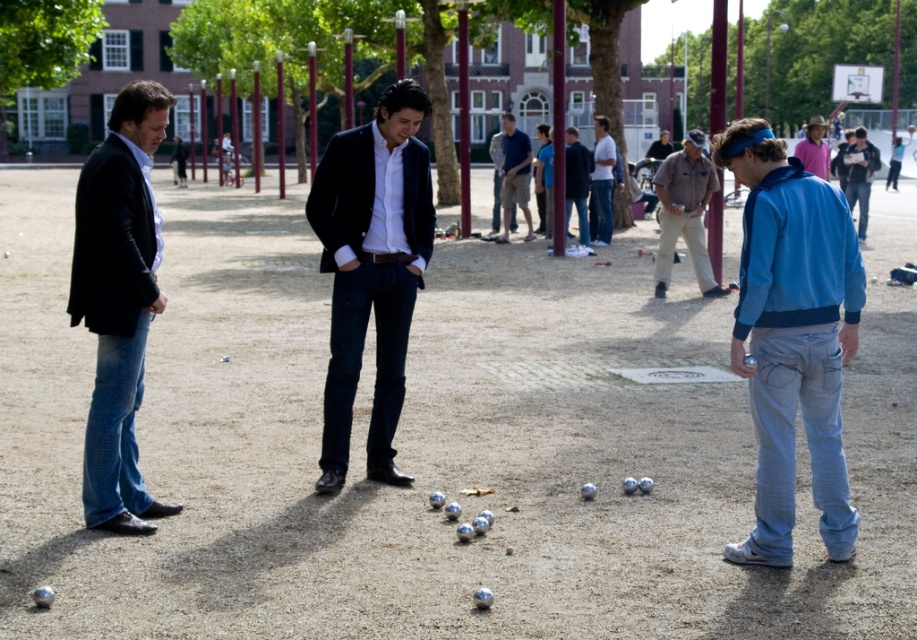
Does blue fleece jacket at right have a smaller size compared to dark blue jeans at center?

No.

Which is above, blue fleece jacket at right or dark blue jeans at center?

dark blue jeans at center is above.

Who is more forward, (810, 312) or (576, 182)?

Point (810, 312)

At what (x,y) coordinates should I click in order to perform the action: click on blue fleece jacket at right. Please return your answer as a coordinate pair (x, y). This screenshot has width=917, height=640. Looking at the image, I should click on (792, 337).

From the picture: Can you confirm if blue fleece jacket at right is positioned above matte black suit at center?

No.

Is point (777, 163) farther from viewer compared to point (381, 472)?

No.

You are a GUI agent. You are given a task and a screenshot of the screen. Output one action in this format:
    pyautogui.click(x=<x>, y=<y>)
    Task: Click on the blue fleece jacket at right
    This screenshot has height=640, width=917.
    Given the screenshot: What is the action you would take?
    pyautogui.click(x=792, y=337)

Who is more distant from viewer, (404, 168) or (571, 157)?

Point (571, 157)

At what (x,y) coordinates should I click in order to perform the action: click on matte black suit at center. Please return your answer as a coordinate pair (x, y). Image resolution: width=917 pixels, height=640 pixels. Looking at the image, I should click on (371, 268).